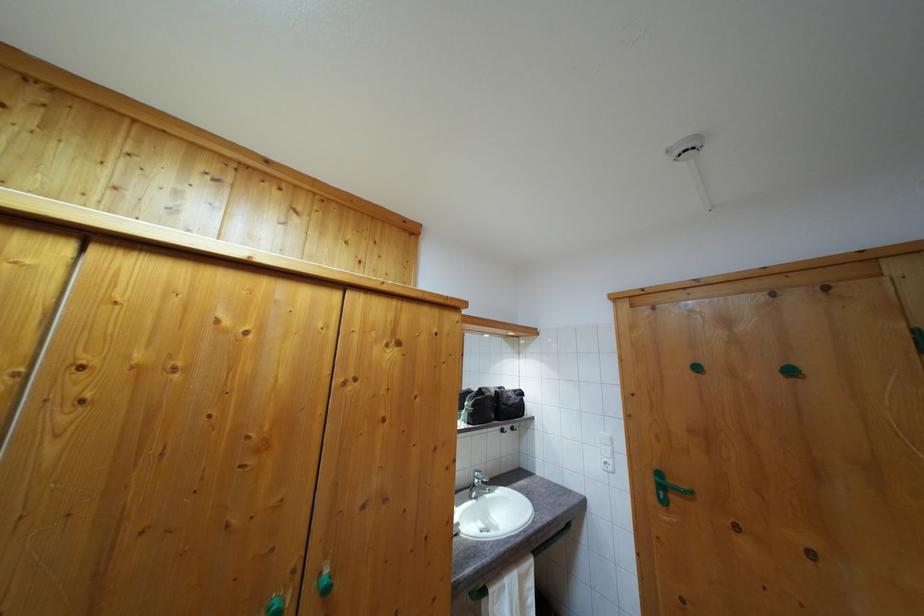
Describe the element at coordinates (479, 485) in the screenshot. I see `a faucet handle` at that location.